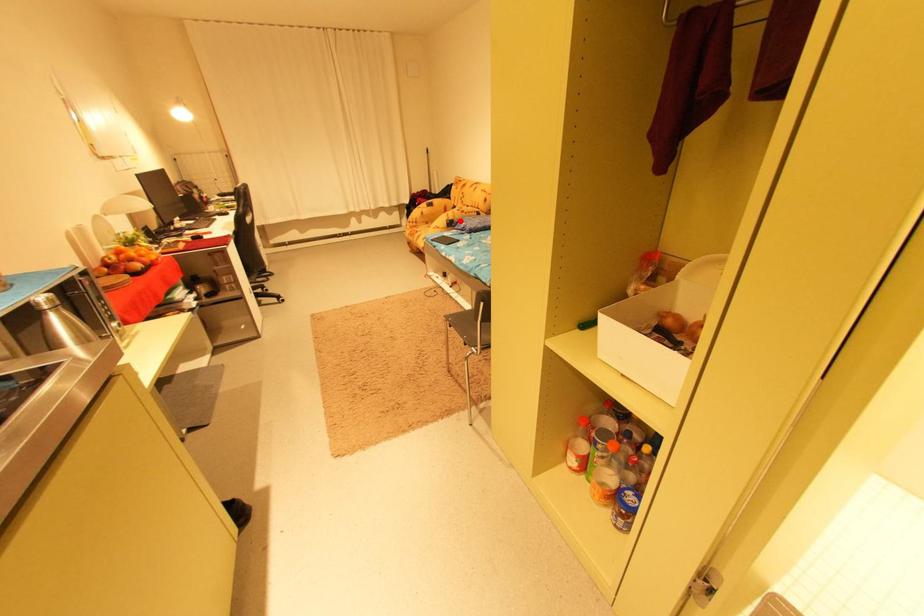
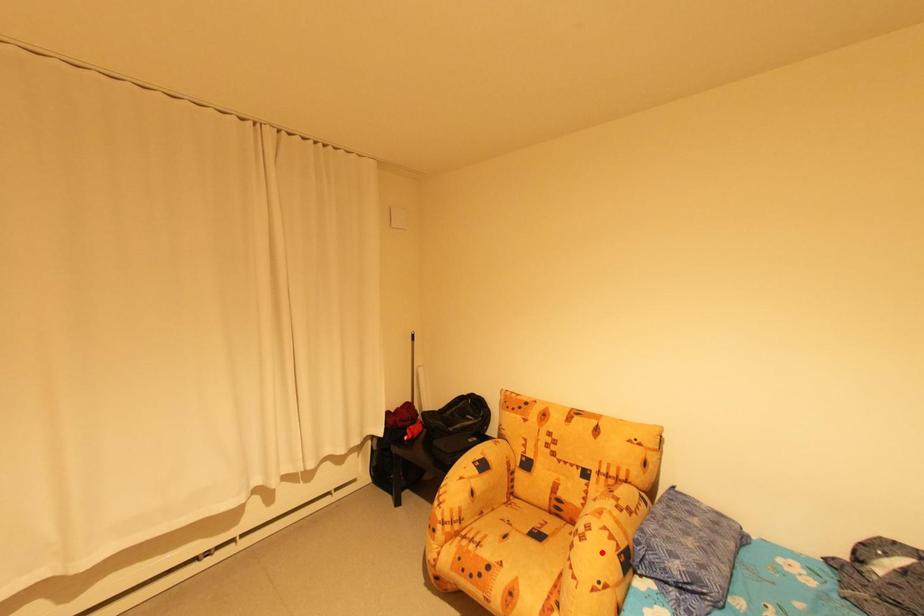
I am providing you with two images of the same scene from different viewpoints. A red point is marked on the first image and another point is marked on the second image. Do the highlighted points in image1 and image2 indicate the same real-world spot?

No